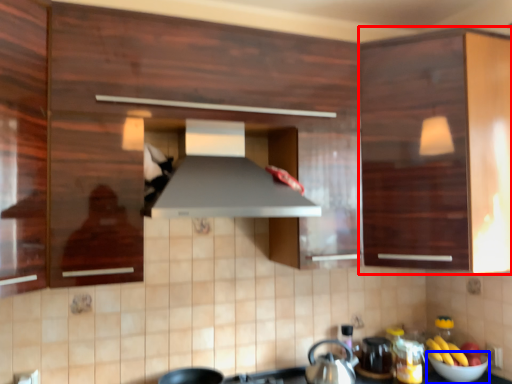
Question: Which point is further to the camera, cabinetry (highlighted by a red box) or bowl (highlighted by a blue box)?

Choices:
 (A) cabinetry
 (B) bowl

Answer: (B)